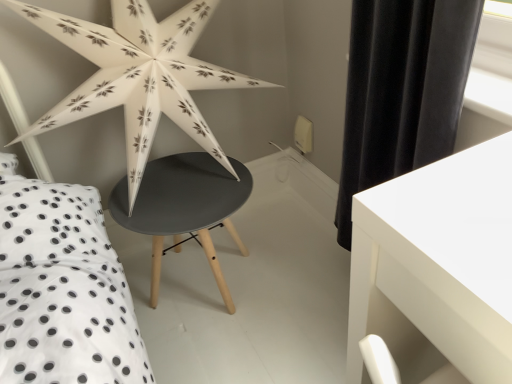
Measure the distance between white paper star at upper left and camera.

The depth of white paper star at upper left is 1.14 meters.

Find the location of a particular element. This screenshot has width=512, height=384. matte black table at center, the first table when ordered from left to right is located at coordinates (184, 206).

The width and height of the screenshot is (512, 384). What are the coordinates of `white glossy table at lower right, the first table in the front-to-back sequence` in the screenshot? It's located at (437, 267).

Locate an element on the screen. Image resolution: width=512 pixels, height=384 pixels. white paper star at upper left is located at coordinates (139, 75).

Is white glossy table at lower right, the second table positioned from the left, in front of or behind matte black table at center, which is the 2th table from front to back, in the image?

white glossy table at lower right, the second table positioned from the left, is positioned closer to the viewer than matte black table at center, which is the 2th table from front to back.

Is white glossy table at lower right, the second table positioned from the left, spatially inside matte black table at center, which is the 2th table from front to back, or outside of it?

white glossy table at lower right, the second table positioned from the left, exists outside the volume of matte black table at center, which is the 2th table from front to back.

Is white glossy table at lower right, the 1th table positioned from the right, taller or shorter than matte black table at center, the first table when ordered from left to right?

white glossy table at lower right, the 1th table positioned from the right, is taller than matte black table at center, the first table when ordered from left to right.

In the image, there is a matte black table at center, which is the first table from back to front. Where is `table below it (from the image's perspective)`? table below it (from the image's perspective) is located at coordinates (437, 267).

Is matte black table at center, which is the 2th table from front to back, in front of white glossy table at lower right, the 1th table positioned from the right?

No, matte black table at center, which is the 2th table from front to back, is further to the viewer.

Consider the image. How different are the orientations of matte black table at center, which is the 2th table from front to back, and white glossy table at lower right, the second table positioned from the left, in degrees?

90 degrees.

Between matte black table at center, which is the 2th table from front to back, and white glossy table at lower right, the 1th table positioned from the right, which one appears on the right side from the viewer's perspective?

white glossy table at lower right, the 1th table positioned from the right.

How many degrees apart are the facing directions of white paper star at upper left and matte black table at center, arranged as the second table when viewed from the right?

The angular difference between white paper star at upper left and matte black table at center, arranged as the second table when viewed from the right, is 2.12 degrees.

Is white paper star at upper left far from matte black table at center, which is the 2th table from front to back?

No, white paper star at upper left is in close proximity to matte black table at center, which is the 2th table from front to back.

Which of these two, white paper star at upper left or matte black table at center, the first table when ordered from left to right, stands taller?

With more height is white paper star at upper left.

Which is correct: white paper star at upper left is inside white glossy table at lower right, the 1th table positioned from the right, or outside of it?

white paper star at upper left is not inside white glossy table at lower right, the 1th table positioned from the right, it's outside.

Which is behind, point (199, 125) or point (381, 198)?

Positioned behind is point (199, 125).

Is white paper star at upper left positioned with its back to white glossy table at lower right, the 2th table positioned from the back?

white paper star at upper left is not turned away from white glossy table at lower right, the 2th table positioned from the back.

Between white glossy table at lower right, the second table positioned from the left, and white paper star at upper left, which one has larger width?

Wider between the two is white glossy table at lower right, the second table positioned from the left.

What's the angular difference between white glossy table at lower right, the first table in the front-to-back sequence, and white paper star at upper left's facing directions?

They differ by 87.9 degrees in their facing directions.

Can you confirm if white glossy table at lower right, the first table in the front-to-back sequence, is shorter than white paper star at upper left?

Incorrect, the height of white glossy table at lower right, the first table in the front-to-back sequence, does not fall short of that of white paper star at upper left.

The width and height of the screenshot is (512, 384). In order to click on star lying above the white glossy table at lower right, the 1th table positioned from the right (from the image's perspective) in this screenshot , I will do `click(139, 75)`.

From the image's perspective, does matte black table at center, the first table when ordered from left to right, appear lower than white paper star at upper left?

Yes, from the image's perspective, matte black table at center, the first table when ordered from left to right, is below white paper star at upper left.

Based on their positions, is matte black table at center, which is the 2th table from front to back, located to the left or right of white paper star at upper left?

matte black table at center, which is the 2th table from front to back, is to the right of white paper star at upper left.

Measure the distance between matte black table at center, which is the first table from back to front, and white paper star at upper left.

A distance of 9.87 inches exists between matte black table at center, which is the first table from back to front, and white paper star at upper left.

Which object is thinner, matte black table at center, which is the first table from back to front, or white paper star at upper left?

white paper star at upper left is thinner.

In order to click on table below the white glossy table at lower right, the 2th table positioned from the back (from a real-world perspective) in this screenshot , I will do `click(184, 206)`.

Find the location of a particular element. table above the matte black table at center, the first table when ordered from left to right (from a real-world perspective) is located at coordinates (437, 267).

Looking at the image, which one is located closer to white glossy table at lower right, the 1th table positioned from the right, matte black table at center, the first table when ordered from left to right, or white paper star at upper left?

The object closer to white glossy table at lower right, the 1th table positioned from the right, is matte black table at center, the first table when ordered from left to right.

Looking at the image, which one is located further to white paper star at upper left, white glossy table at lower right, the 1th table positioned from the right, or matte black table at center, the first table when ordered from left to right?

The object further to white paper star at upper left is white glossy table at lower right, the 1th table positioned from the right.

Looking at the image, which one is located further to matte black table at center, the first table when ordered from left to right, white paper star at upper left or white glossy table at lower right, the 1th table positioned from the right?

white glossy table at lower right, the 1th table positioned from the right.

Based on their spatial positions, is white paper star at upper left or matte black table at center, arranged as the second table when viewed from the right, closer to white glossy table at lower right, the first table in the front-to-back sequence?

matte black table at center, arranged as the second table when viewed from the right, is positioned closer to the anchor white glossy table at lower right, the first table in the front-to-back sequence.

From the image, which object appears to be farther from white paper star at upper left, matte black table at center, the first table when ordered from left to right, or white glossy table at lower right, the second table positioned from the left?

Among the two, white glossy table at lower right, the second table positioned from the left, is located further to white paper star at upper left.

Looking at this image, estimate the real-world distances between objects in this image. Which object is closer to matte black table at center, which is the 2th table from front to back, white glossy table at lower right, the second table positioned from the left, or white paper star at upper left?

white paper star at upper left lies closer to matte black table at center, which is the 2th table from front to back, than the other object.

The height and width of the screenshot is (384, 512). What are the coordinates of `star located between white glossy table at lower right, the 1th table positioned from the right, and matte black table at center, which is the first table from back to front, in the depth direction` in the screenshot? It's located at (139, 75).